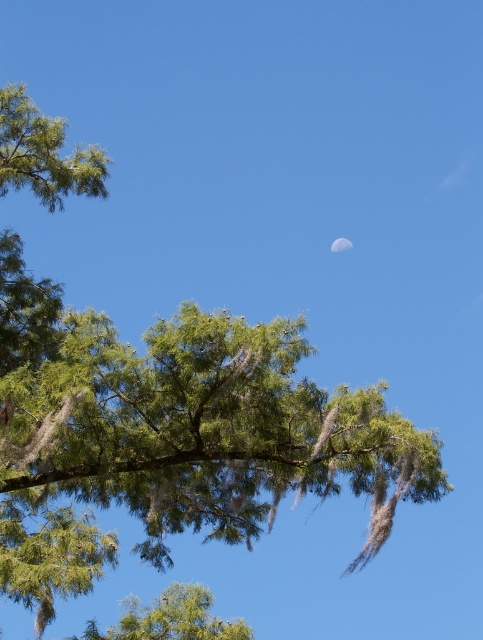
Between green leafy tree at lower center and silvery reflective moon at upper center, which one has less height?

With less height is silvery reflective moon at upper center.

Who is higher up, green leafy tree at lower center or silvery reflective moon at upper center?

silvery reflective moon at upper center is higher up.

Image resolution: width=483 pixels, height=640 pixels. What do you see at coordinates (170, 618) in the screenshot?
I see `green leafy tree at lower center` at bounding box center [170, 618].

Locate an element on the screen. Image resolution: width=483 pixels, height=640 pixels. green leafy tree at lower center is located at coordinates (170, 618).